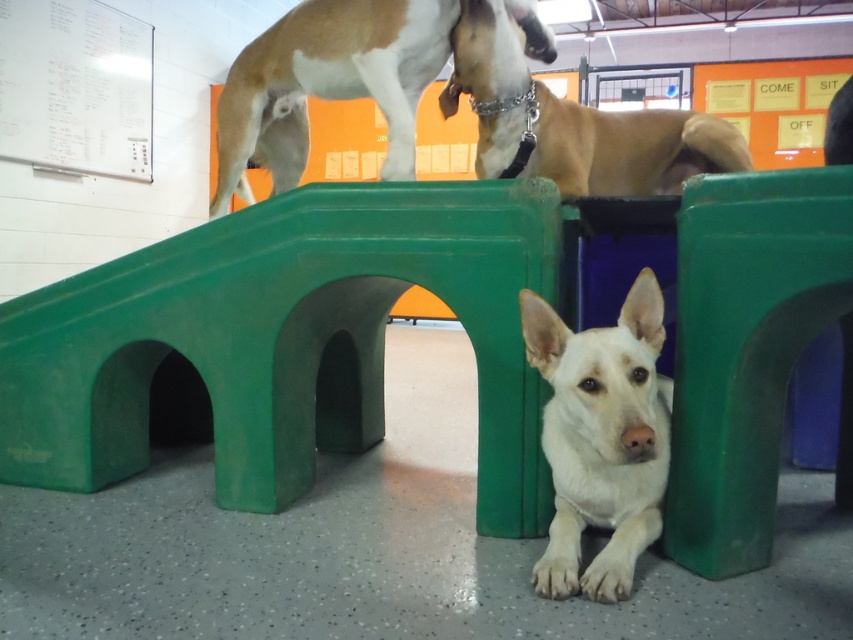
You are a dog trainer standing in front of the green plastic hurdle at lower center. You want to place a treat 3 feet away from the hurdle. Is the treat within your reach if you can reach up to 6 feet?

The green plastic hurdle at lower center is 5.32 feet from viewer. Placing a treat 3 feet away from the hurdle would place it at 5.32 feet minus 3 feet equals 2.32 feet from the viewer. Since the trainer can reach up to 6 feet, the treat is within reach.

You are a dog trainer observing the training facility. You notice the green plastic hurdle at lower center and the brown matte dog at upper center. Which object is closer to the camera?

The green plastic hurdle at lower center is closer to the camera because it is in front of the brown matte dog at upper center.